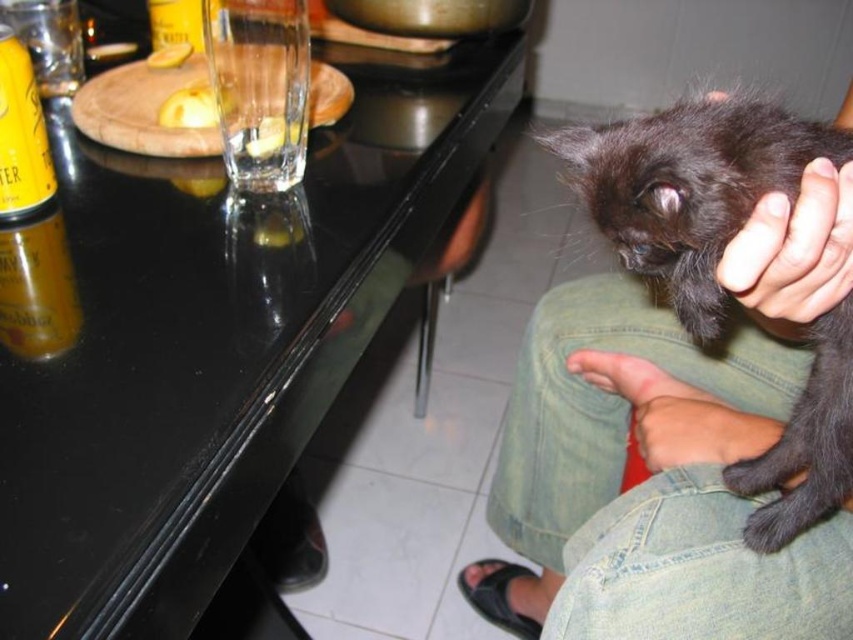
You are a photographer trying to capture a closeup shot of the black fluffy cat at upper right and the smooth skin hand at lower right. Can you fit both subjects in the frame if your camera has a maximum width of 1 meter?

The black fluffy cat at upper right might be wider than smooth skin hand at lower right, so it is uncertain if both subjects can fit within the camera frame with a maximum width of 1 meter.

You are a photographer trying to capture the reflection of the black matte hand at upper right on the black glossy table at center. Can you see the reflection of the hand in the table?

The black glossy table at center is above the black matte hand at upper right, so the hand is below the table. Since the table is reflective, its surface can only reflect objects placed in front of or at the same level as it. The hand being below means its reflection would not appear on the table. Therefore, you cannot see the reflection of the black matte hand at upper right on the black glossy table at center.